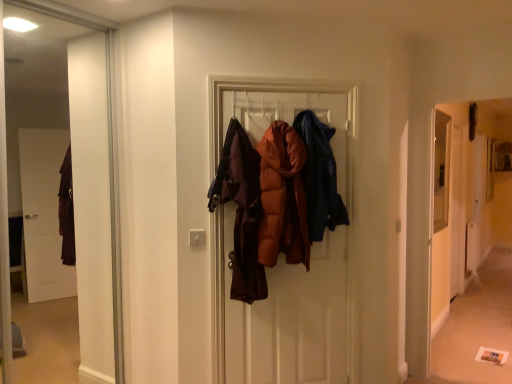
Question: Is carpeted floor at lower right positioned far away from transparent glass screen door at right?

Choices:
 (A) yes
 (B) no

Answer: (B)

Question: Considering the relative positions of carpeted floor at lower right and transparent glass screen door at right in the image provided, is carpeted floor at lower right to the right of transparent glass screen door at right from the viewer's perspective?

Choices:
 (A) yes
 (B) no

Answer: (B)

Question: Is carpeted floor at lower right aimed at transparent glass screen door at right?

Choices:
 (A) no
 (B) yes

Answer: (A)

Question: From a real-world perspective, is carpeted floor at lower right beneath transparent glass screen door at right?

Choices:
 (A) no
 (B) yes

Answer: (A)

Question: From a real-world perspective, does carpeted floor at lower right stand above transparent glass screen door at right?

Choices:
 (A) no
 (B) yes

Answer: (B)

Question: Is matte brown puffer jacket at center, the 1th garment positioned from the left, to the left or to the right of dark blue denim jacket at center, placed as the 2th garment when sorted from left to right, in the image?

Choices:
 (A) right
 (B) left

Answer: (B)

Question: Is point (292, 140) closer or farther from the camera than point (316, 147)?

Choices:
 (A) farther
 (B) closer

Answer: (B)

Question: From their relative heights in the image, would you say matte brown puffer jacket at center, positioned as the 2th garment in right-to-left order, is taller or shorter than dark blue denim jacket at center, placed as the 2th garment when sorted from left to right?

Choices:
 (A) tall
 (B) short

Answer: (A)

Question: Is matte brown puffer jacket at center, the 1th garment positioned from the left, situated inside dark blue denim jacket at center, the first garment when ordered from right to left, or outside?

Choices:
 (A) outside
 (B) inside

Answer: (A)

Question: Choose the correct answer: Is carpeted floor at lower right inside matte brown puffer jacket at center, the 1th garment positioned from the left, or outside it?

Choices:
 (A) inside
 (B) outside

Answer: (B)

Question: Considering the positions of carpeted floor at lower right and matte brown puffer jacket at center, the 1th garment positioned from the left, in the image, is carpeted floor at lower right bigger or smaller than matte brown puffer jacket at center, the 1th garment positioned from the left,?

Choices:
 (A) big
 (B) small

Answer: (B)

Question: In terms of width, does carpeted floor at lower right look wider or thinner when compared to matte brown puffer jacket at center, positioned as the 2th garment in right-to-left order?

Choices:
 (A) thin
 (B) wide

Answer: (A)

Question: Considering their positions, is carpeted floor at lower right located in front of or behind matte brown puffer jacket at center, positioned as the 2th garment in right-to-left order?

Choices:
 (A) front
 (B) behind

Answer: (B)

Question: From the image's perspective, relative to carpeted floor at lower right, is dark blue denim jacket at center, placed as the 2th garment when sorted from left to right, above or below?

Choices:
 (A) above
 (B) below

Answer: (A)

Question: Is dark blue denim jacket at center, placed as the 2th garment when sorted from left to right, bigger or smaller than carpeted floor at lower right?

Choices:
 (A) big
 (B) small

Answer: (B)